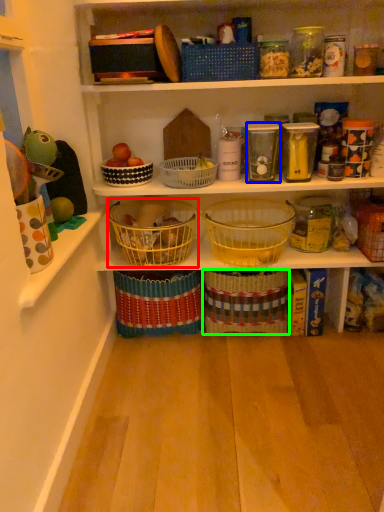
Question: Which object is positioned farthest from basket (highlighted by a red box)? Select from glass jar (highlighted by a blue box) and basket (highlighted by a green box).

Choices:
 (A) glass jar
 (B) basket

Answer: (A)